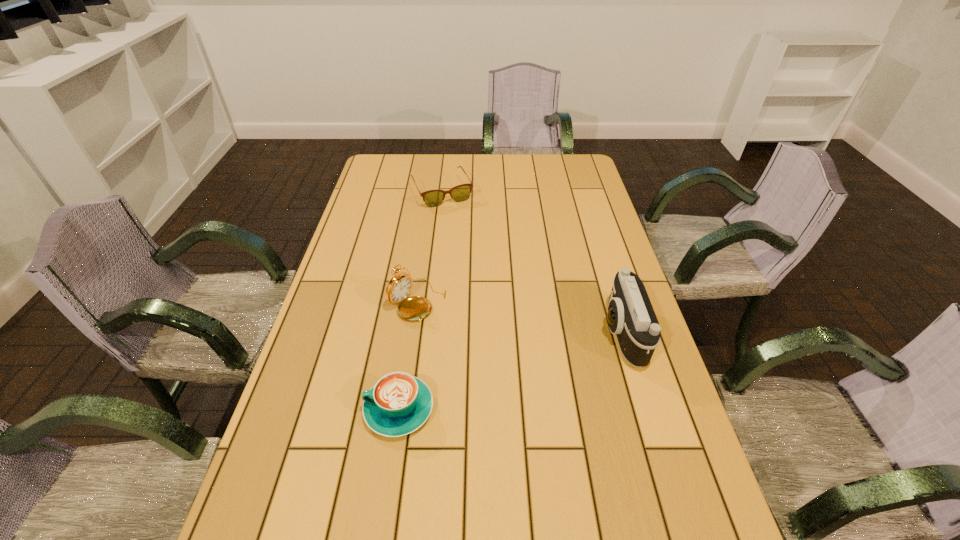
I want to click on vacant space in between the rightmost object and the farthest object, so click(x=532, y=262).

Point out which object is positioned as the second nearest to the pocket watch. Please provide its 2D coordinates. Your answer should be formatted as a tuple, i.e. [(x, y)], where the tuple contains the x and y coordinates of a point satisfying the conditions above.

[(432, 198)]

Locate an element on the screen. The height and width of the screenshot is (540, 960). object that ranks as the third closest to the farthest object is located at coordinates (398, 404).

You are a GUI agent. You are given a task and a screenshot of the screen. Output one action in this format:
    pyautogui.click(x=<x>, y=<y>)
    Task: Click on the blank space that satisfies the following two spatial constraints: 1. on the front side of the camera; 2. on the front lens of the farthest object
    Image resolution: width=960 pixels, height=540 pixels.
    Given the screenshot: What is the action you would take?
    pyautogui.click(x=426, y=333)

Where is `free spot that satisfies the following two spatial constraints: 1. on the front side of the camera; 2. on the front lens of the spectacles`? This screenshot has height=540, width=960. free spot that satisfies the following two spatial constraints: 1. on the front side of the camera; 2. on the front lens of the spectacles is located at coordinates (426, 333).